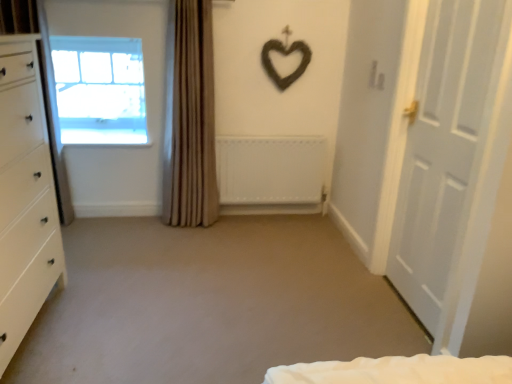
Question: Is the depth of transparent glass window at upper left less than that of white glossy chest of drawers at left?

Choices:
 (A) yes
 (B) no

Answer: (B)

Question: Can you confirm if transparent glass window at upper left is shorter than white glossy chest of drawers at left?

Choices:
 (A) yes
 (B) no

Answer: (A)

Question: Considering the relative positions of transparent glass window at upper left and white glossy chest of drawers at left in the image provided, is transparent glass window at upper left to the right of white glossy chest of drawers at left from the viewer's perspective?

Choices:
 (A) no
 (B) yes

Answer: (A)

Question: Is transparent glass window at upper left to the left of white glossy chest of drawers at left from the viewer's perspective?

Choices:
 (A) no
 (B) yes

Answer: (B)

Question: Could you tell me if transparent glass window at upper left is turned towards white glossy chest of drawers at left?

Choices:
 (A) yes
 (B) no

Answer: (A)

Question: Is point (126, 140) positioned closer to the camera than point (225, 140)?

Choices:
 (A) farther
 (B) closer

Answer: (A)

Question: Considering the positions of transparent glass window at upper left and white matte radiator at center in the image, is transparent glass window at upper left taller or shorter than white matte radiator at center?

Choices:
 (A) tall
 (B) short

Answer: (A)

Question: From the image's perspective, is transparent glass window at upper left above or below white matte radiator at center?

Choices:
 (A) above
 (B) below

Answer: (A)

Question: Looking at their shapes, would you say transparent glass window at upper left is wider or thinner than white matte radiator at center?

Choices:
 (A) thin
 (B) wide

Answer: (B)

Question: From a real-world perspective, relative to beige fabric curtain at center, is transparent glass window at upper left vertically above or below?

Choices:
 (A) above
 (B) below

Answer: (A)

Question: Considering the positions of transparent glass window at upper left and beige fabric curtain at center in the image, is transparent glass window at upper left wider or thinner than beige fabric curtain at center?

Choices:
 (A) wide
 (B) thin

Answer: (B)

Question: Is point (86, 92) positioned closer to the camera than point (181, 142)?

Choices:
 (A) closer
 (B) farther

Answer: (B)

Question: Considering the positions of transparent glass window at upper left and beige fabric curtain at center in the image, is transparent glass window at upper left bigger or smaller than beige fabric curtain at center?

Choices:
 (A) big
 (B) small

Answer: (B)

Question: From a real-world perspective, is beige fabric curtain at center physically located above or below white matte radiator at center?

Choices:
 (A) above
 (B) below

Answer: (A)

Question: In the image, is beige fabric curtain at center positioned in front of or behind white matte radiator at center?

Choices:
 (A) behind
 (B) front

Answer: (B)